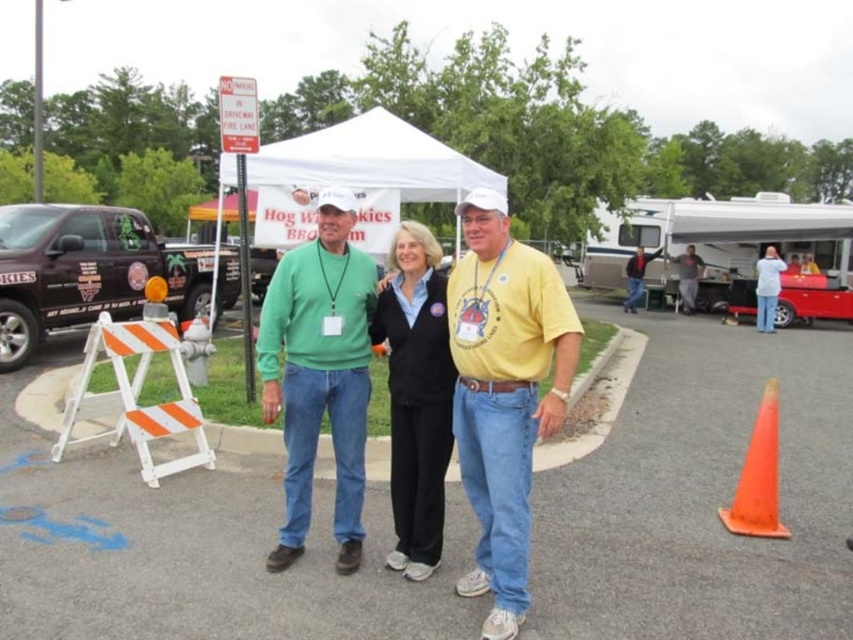
You are planning to set up a temporary food stall between the black matte truck at left and the white canvas canopy at upper center. The stall requires a space of 7 meters. Based on the scene description, will there be enough space between them to accommodate your stall?

The black matte truck at left and white canvas canopy at upper center are 8.00 meters apart, so yes, there is enough space to set up a 7 meter stall between them.

Based on the photo, you are at the Hog Wild Skies BBQ event and need to locate the orange matte traffic cone at lower right. According to the image, what are the coordinates of this object?

The orange matte traffic cone at lower right is located at coordinates point (758, 476).